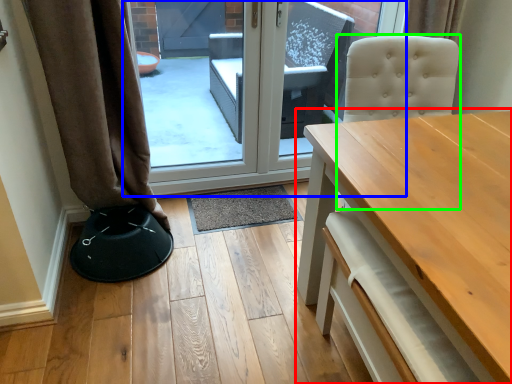
Question: Estimate the real-world distances between objects in this image. Which object is farther from table (highlighted by a red box), door (highlighted by a blue box) or swivel chair (highlighted by a green box)?

Choices:
 (A) door
 (B) swivel chair

Answer: (A)